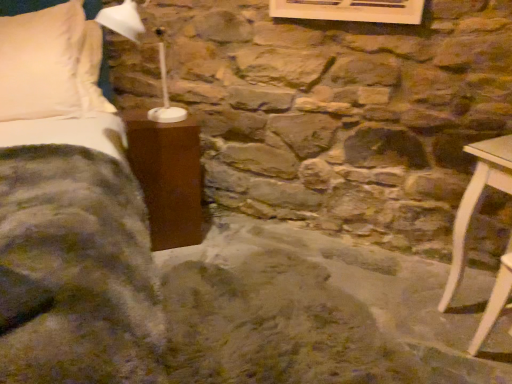
Find the location of `velvet green blanket at left`. velvet green blanket at left is located at coordinates (70, 215).

At what (x,y) coordinates should I click in order to perform the action: click on white wood chair at lower right, marked as the 1th furniture in a bottom-to-top arrangement. Please return your answer as a coordinate pair (x, y). Looking at the image, I should click on (494, 304).

How much space does matte brown nightstand at left, the second furniture in the right-to-left sequence, occupy vertically?

The height of matte brown nightstand at left, the second furniture in the right-to-left sequence, is 26.47 inches.

This screenshot has height=384, width=512. What are the coordinates of `white plastic table lamp at upper left` in the screenshot? It's located at (122, 20).

This screenshot has height=384, width=512. What are the coordinates of `furniture that is below the velvet green blanket at left (from the image's perspective)` in the screenshot? It's located at (494, 304).

Is velvet green blanket at left turned away from white wood chair at lower right, marked as the 1th furniture in a bottom-to-top arrangement?

No, velvet green blanket at left is not facing the opposite direction of white wood chair at lower right, marked as the 1th furniture in a bottom-to-top arrangement.

Is velvet green blanket at left to the right of white wood chair at lower right, placed as the first furniture when sorted from front to back, from the viewer's perspective?

No, velvet green blanket at left is not to the right of white wood chair at lower right, placed as the first furniture when sorted from front to back.

Is velvet green blanket at left to the right of matte brown nightstand at left, which is counted as the first furniture, starting from the top, from the viewer's perspective?

Yes.

What's the angular difference between velvet green blanket at left and matte brown nightstand at left, which appears as the 1th furniture when viewed from the back,'s facing directions?

There is a 4.89-degree angle between the facing directions of velvet green blanket at left and matte brown nightstand at left, which appears as the 1th furniture when viewed from the back.

Is the position of velvet green blanket at left less distant than that of matte brown nightstand at left, which is counted as the first furniture, starting from the top?

Yes, the depth of velvet green blanket at left is less than that of matte brown nightstand at left, which is counted as the first furniture, starting from the top.

From the picture: Considering the sizes of objects velvet green blanket at left and matte brown nightstand at left, which is counted as the first furniture, starting from the top, in the image provided, who is smaller, velvet green blanket at left or matte brown nightstand at left, which is counted as the first furniture, starting from the top,?

With smaller size is matte brown nightstand at left, which is counted as the first furniture, starting from the top.

Based on the photo, which object is thinner, matte brown nightstand at left, which appears as the 1th furniture when viewed from the back, or velvet green blanket at left?

matte brown nightstand at left, which appears as the 1th furniture when viewed from the back.

Based on the photo, between matte brown nightstand at left, the 1th furniture when ordered from left to right, and velvet green blanket at left, which one has more height?

Standing taller between the two is velvet green blanket at left.

Is matte brown nightstand at left, positioned as the second furniture in front-to-back order, inside the boundaries of velvet green blanket at left, or outside?

matte brown nightstand at left, positioned as the second furniture in front-to-back order, is inside velvet green blanket at left.

In the scene shown: From the image's perspective, which is below, white wood chair at lower right, which is the first furniture from right to left, or velvet green blanket at left?

white wood chair at lower right, which is the first furniture from right to left, appears lower in the image.

Who is more distant, white wood chair at lower right, the 2th furniture in the top-to-bottom sequence, or velvet green blanket at left?

white wood chair at lower right, the 2th furniture in the top-to-bottom sequence, is behind.

At what (x,y) coordinates should I click in order to perform the action: click on bed to the left of white wood chair at lower right, the 2th furniture in the top-to-bottom sequence. Please return your answer as a coordinate pair (x, y). This screenshot has height=384, width=512. Looking at the image, I should click on (70, 215).

In the scene shown: Could you measure the distance between white wood chair at lower right, placed as the first furniture when sorted from front to back, and velvet green blanket at left?

white wood chair at lower right, placed as the first furniture when sorted from front to back, and velvet green blanket at left are 5.13 feet apart from each other.

Between white plastic table lamp at upper left and white wood chair at lower right, marked as the 1th furniture in a bottom-to-top arrangement, which one has larger width?

white plastic table lamp at upper left is wider.

Consider the image. Can you confirm if white plastic table lamp at upper left is smaller than white wood chair at lower right, which is the first furniture from right to left?

No.

Can we say white plastic table lamp at upper left lies outside white wood chair at lower right, marked as the 1th furniture in a bottom-to-top arrangement?

Yes, white plastic table lamp at upper left is outside of white wood chair at lower right, marked as the 1th furniture in a bottom-to-top arrangement.

From a real-world perspective, relative to white wood chair at lower right, placed as the first furniture when sorted from front to back, is white plastic table lamp at upper left vertically above or below?

In terms of real-world spatial position, white plastic table lamp at upper left is above white wood chair at lower right, placed as the first furniture when sorted from front to back.

Does white wood chair at lower right, the second furniture viewed from the left, lie in front of matte brown nightstand at left, which appears as the 1th furniture when viewed from the back?

Yes, it is.

Is point (478, 339) more distant than point (177, 145)?

No, it is in front of (177, 145).

In the scene shown: How different are the orientations of white wood chair at lower right, marked as the 1th furniture in a bottom-to-top arrangement, and matte brown nightstand at left, which is counted as the first furniture, starting from the top, in degrees?

There is a 82.6-degree angle between the facing directions of white wood chair at lower right, marked as the 1th furniture in a bottom-to-top arrangement, and matte brown nightstand at left, which is counted as the first furniture, starting from the top.

From the image's perspective, between white plastic table lamp at upper left and velvet green blanket at left, who is located below?

velvet green blanket at left appears lower in the image.

Is white plastic table lamp at upper left situated inside velvet green blanket at left or outside?

white plastic table lamp at upper left is spatially positioned inside velvet green blanket at left.

Considering the relative positions of white plastic table lamp at upper left and velvet green blanket at left in the image provided, is white plastic table lamp at upper left to the right of velvet green blanket at left from the viewer's perspective?

Incorrect, white plastic table lamp at upper left is not on the right side of velvet green blanket at left.

Where is `bed in front of the white plastic table lamp at upper left`? bed in front of the white plastic table lamp at upper left is located at coordinates (70, 215).

Locate an element on the screen. The width and height of the screenshot is (512, 384). bed in front of the white wood chair at lower right, which is the first furniture from right to left is located at coordinates (70, 215).

Identify the location of furniture above the velvet green blanket at left (from the image's perspective). (168, 177).

From the image, which object appears to be nearer to white plastic table lamp at upper left, velvet green blanket at left or white wood chair at lower right, marked as the 1th furniture in a bottom-to-top arrangement?

Based on the image, velvet green blanket at left appears to be nearer to white plastic table lamp at upper left.

Estimate the real-world distances between objects in this image. Which object is further from matte brown nightstand at left, which is counted as the first furniture, starting from the top, white plastic table lamp at upper left or white wood chair at lower right, placed as the first furniture when sorted from front to back?

Based on the image, white wood chair at lower right, placed as the first furniture when sorted from front to back, appears to be further to matte brown nightstand at left, which is counted as the first furniture, starting from the top.

From the image, which object appears to be farther from velvet green blanket at left, white plastic table lamp at upper left or matte brown nightstand at left, the 1th furniture when ordered from left to right?

Among the two, white plastic table lamp at upper left is located further to velvet green blanket at left.

Considering their positions, is velvet green blanket at left positioned closer to white wood chair at lower right, the 2th furniture in the top-to-bottom sequence, than matte brown nightstand at left, positioned as the second furniture in front-to-back order?

matte brown nightstand at left, positioned as the second furniture in front-to-back order, is positioned closer to the anchor white wood chair at lower right, the 2th furniture in the top-to-bottom sequence.

Looking at the image, which one is located closer to white wood chair at lower right, which is the first furniture from right to left, velvet green blanket at left or white plastic table lamp at upper left?

velvet green blanket at left is closer to white wood chair at lower right, which is the first furniture from right to left.

Which object lies nearer to the anchor point white plastic table lamp at upper left, velvet green blanket at left or matte brown nightstand at left, placed as the 2th furniture when sorted from bottom to top?

velvet green blanket at left is positioned closer to the anchor white plastic table lamp at upper left.

From the image, which object appears to be farther from velvet green blanket at left, white wood chair at lower right, the 2th furniture in the top-to-bottom sequence, or white plastic table lamp at upper left?

Based on the image, white wood chair at lower right, the 2th furniture in the top-to-bottom sequence, appears to be further to velvet green blanket at left.

When comparing their distances from white plastic table lamp at upper left, does matte brown nightstand at left, which is counted as the first furniture, starting from the top, or white wood chair at lower right, the 2th furniture in the back-to-front sequence, seem further?

Based on the image, white wood chair at lower right, the 2th furniture in the back-to-front sequence, appears to be further to white plastic table lamp at upper left.

The width and height of the screenshot is (512, 384). I want to click on table lamp between velvet green blanket at left and matte brown nightstand at left, the 1th furniture when ordered from left to right, in the front-back direction, so click(122, 20).

You are a GUI agent. You are given a task and a screenshot of the screen. Output one action in this format:
    pyautogui.click(x=<x>, y=<y>)
    Task: Click on the bed between white plastic table lamp at upper left and white wood chair at lower right, which is the first furniture from right to left, in the horizontal direction
    This screenshot has height=384, width=512.
    Given the screenshot: What is the action you would take?
    pyautogui.click(x=70, y=215)

Where is `table lamp between matte brown nightstand at left, positioned as the second furniture in front-to-back order, and white wood chair at lower right, the second furniture viewed from the left`? This screenshot has width=512, height=384. table lamp between matte brown nightstand at left, positioned as the second furniture in front-to-back order, and white wood chair at lower right, the second furniture viewed from the left is located at coordinates (122, 20).

What are the coordinates of `bed between matte brown nightstand at left, placed as the 2th furniture when sorted from bottom to top, and white wood chair at lower right, placed as the first furniture when sorted from front to back, in the horizontal direction` in the screenshot? It's located at (70, 215).